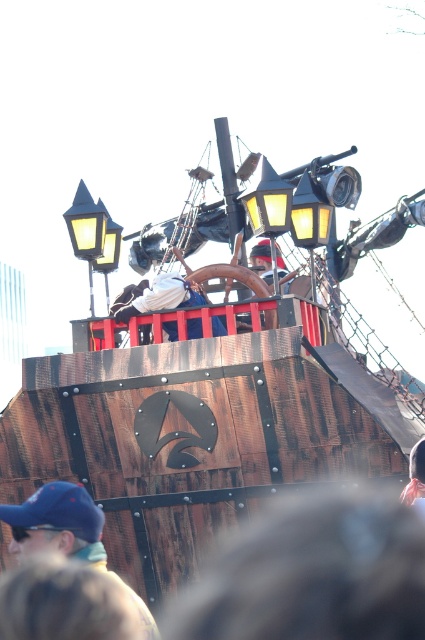
Question: Is blue fabric cap at lower left positioned behind white fabric at center?

Choices:
 (A) yes
 (B) no

Answer: (B)

Question: Does blue fabric cap at lower left appear under white fabric at center?

Choices:
 (A) no
 (B) yes

Answer: (B)

Question: Which point is closer to the camera?

Choices:
 (A) white fabric at center
 (B) blue fabric cap at lower left

Answer: (B)

Question: Among these points, which one is farthest from the camera?

Choices:
 (A) (17, 548)
 (B) (172, 298)

Answer: (B)

Question: Does blue fabric cap at lower left have a greater width compared to white fabric at center?

Choices:
 (A) yes
 (B) no

Answer: (A)